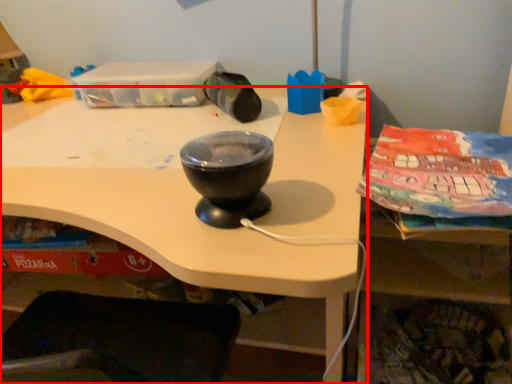
Question: From the image's perspective, where is desk (annotated by the red box) located in relation to basin in the image?

Choices:
 (A) below
 (B) above

Answer: (A)